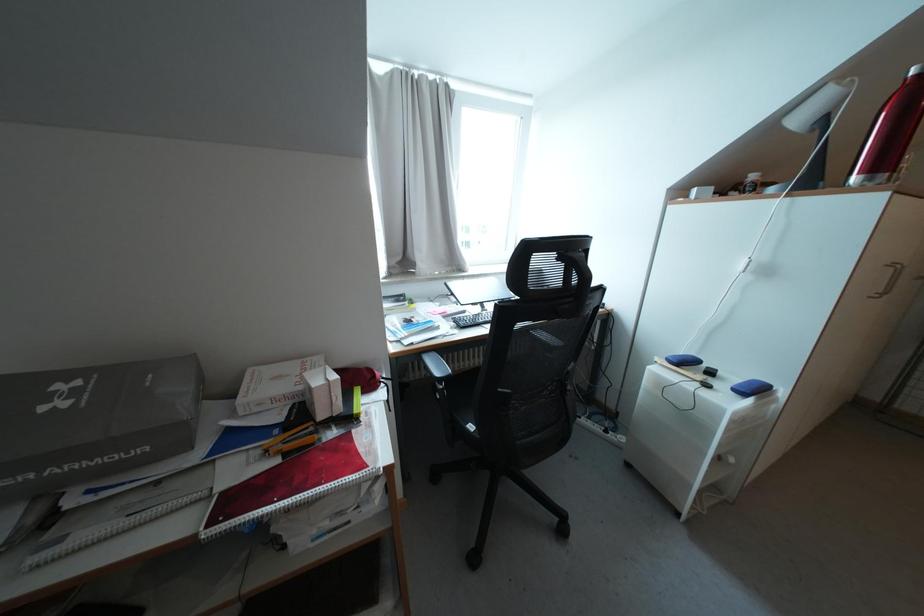
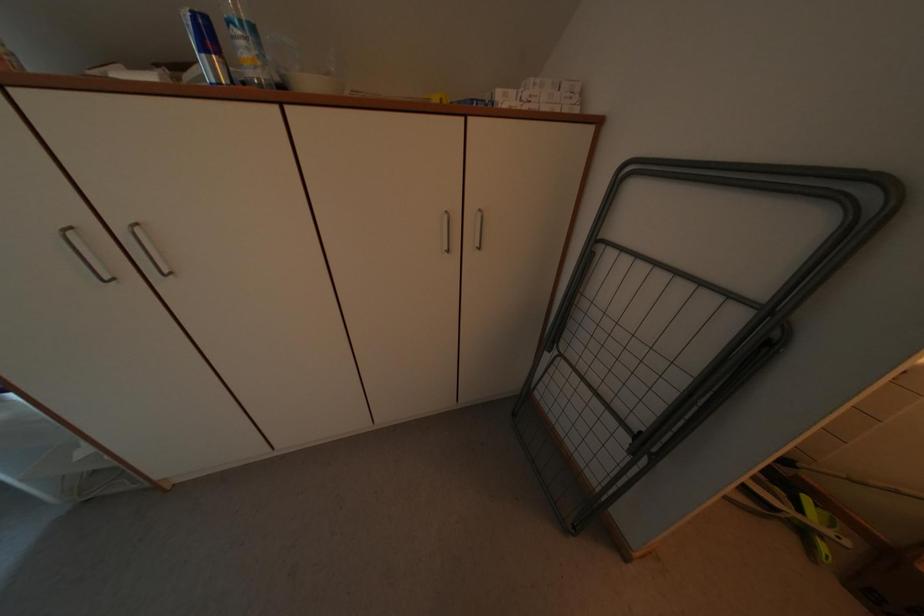
Question: The images are taken continuously from a first-person perspective. In which direction are you moving?

Choices:
 (A) Left
 (B) Right
 (C) Forward
 (D) Backward

Answer: (B)